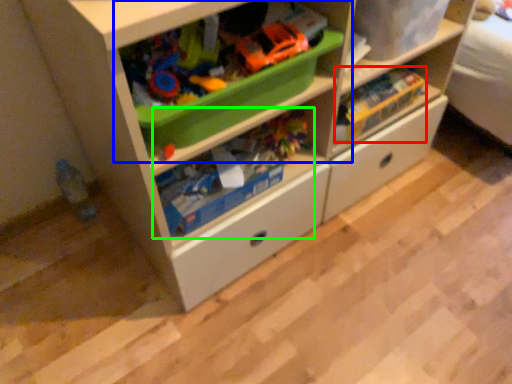
Question: Considering the real-world distances, which object is closest to toy (highlighted by a red box)? shelf (highlighted by a blue box) or toy (highlighted by a green box).

Choices:
 (A) shelf
 (B) toy

Answer: (B)